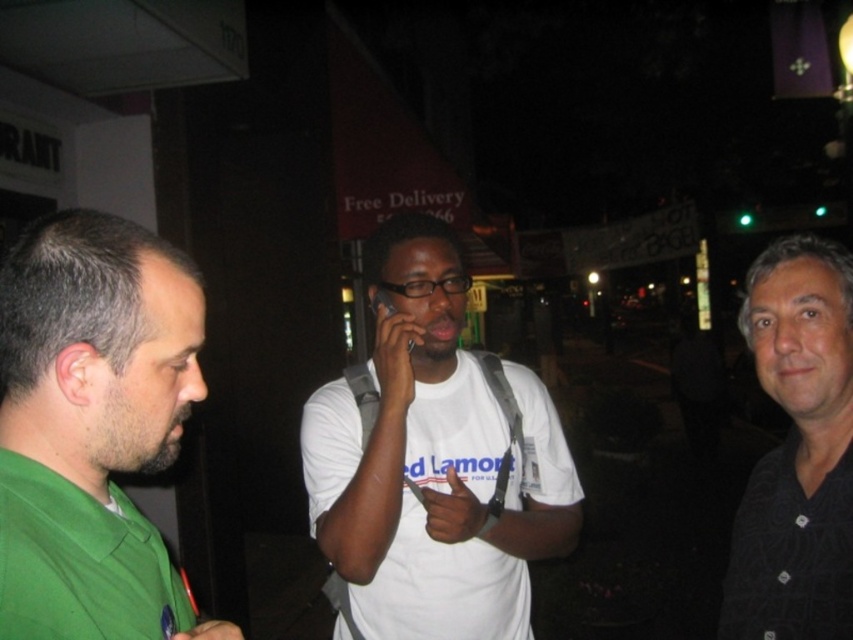
Is green matte shirt at left bigger than black plastic phone at center?

Yes.

Can you confirm if green matte shirt at left is smaller than black plastic phone at center?

Actually, green matte shirt at left might be larger than black plastic phone at center.

Locate an element on the screen. The height and width of the screenshot is (640, 853). green matte shirt at left is located at coordinates (97, 348).

Is white matte t-shirt at center positioned in front of green matte shirt at left?

No, white matte t-shirt at center is behind green matte shirt at left.

Is white matte t-shirt at center below green matte shirt at left?

Indeed, white matte t-shirt at center is positioned under green matte shirt at left.

Between point (503, 593) and point (146, 317), which one is positioned behind?

The point (503, 593) is behind.

What are the coordinates of `white matte t-shirt at center` in the screenshot? It's located at (434, 461).

Is white matte t-shirt at center bigger than black matte shirt at right?

Indeed, white matte t-shirt at center has a larger size compared to black matte shirt at right.

Consider the image. Can you confirm if white matte t-shirt at center is positioned below black matte shirt at right?

Actually, white matte t-shirt at center is above black matte shirt at right.

This screenshot has height=640, width=853. Identify the location of white matte t-shirt at center. (434, 461).